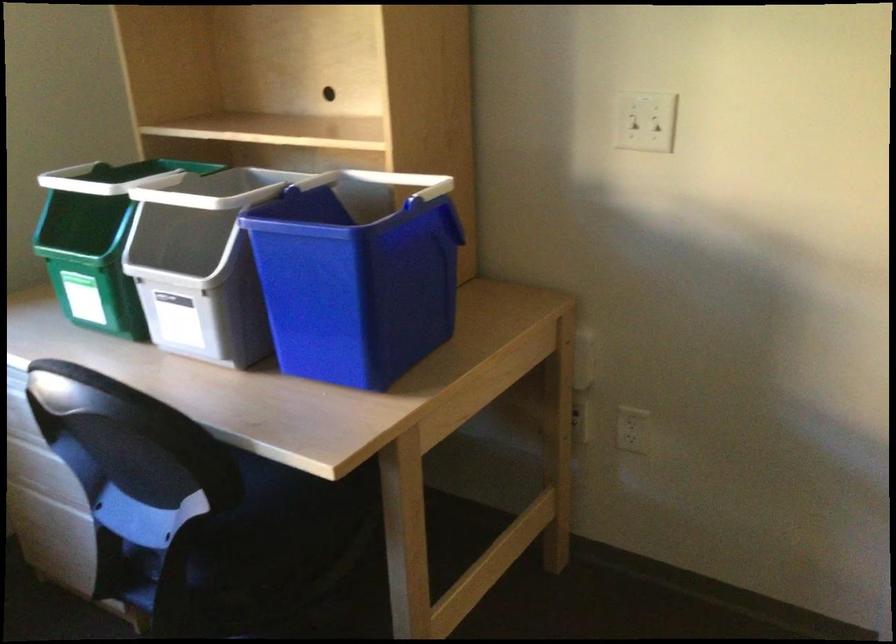
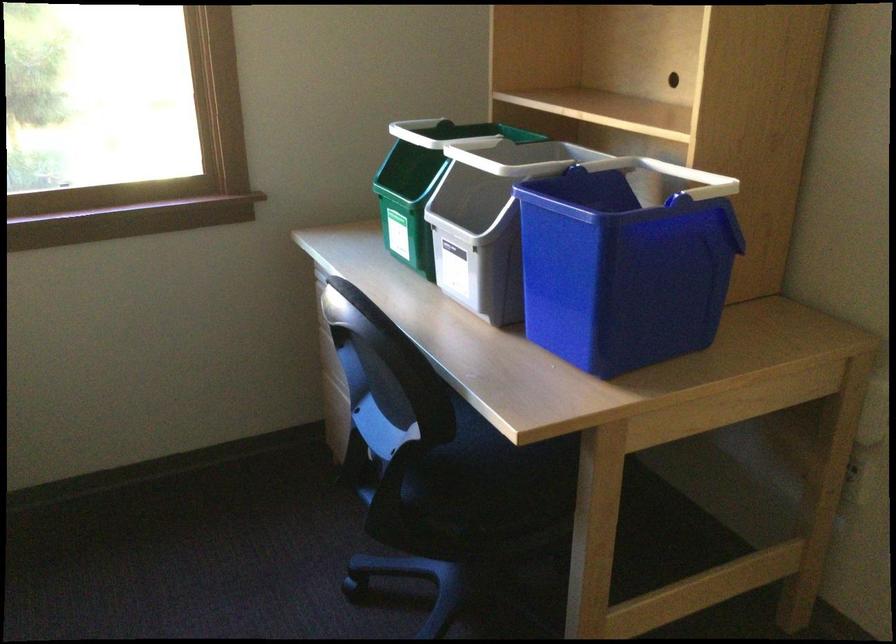
Locate, in the second image, the point that corresponds to [183,245] in the first image.

(479, 201)